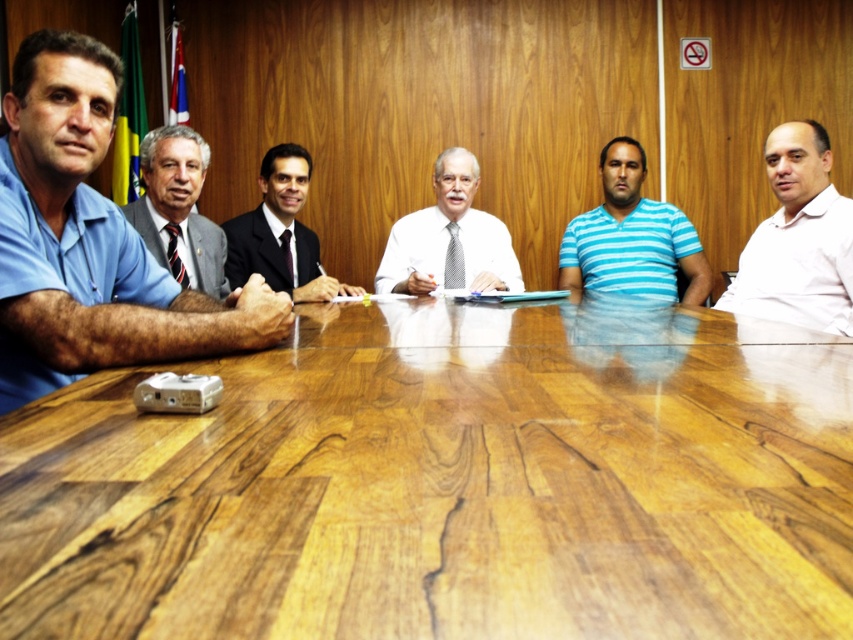
Is wooden table at center further to camera compared to white shirt at center?

No.

Based on the photo, between wooden table at center and white shirt at center, which one has less height?

With less height is wooden table at center.

Image resolution: width=853 pixels, height=640 pixels. Describe the element at coordinates (447, 483) in the screenshot. I see `wooden table at center` at that location.

Identify the location of wooden table at center. This screenshot has height=640, width=853. (447, 483).

In order to click on wooden table at center in this screenshot , I will do tap(447, 483).

Looking at this image, is wooden table at center shorter than blue fabric shirt at left?

Yes, wooden table at center is shorter than blue fabric shirt at left.

At what (x,y) coordinates should I click in order to perform the action: click on wooden table at center. Please return your answer as a coordinate pair (x, y). Looking at the image, I should click on (447, 483).

Can you confirm if blue fabric shirt at left is smaller than blue striped shirt at center?

Incorrect, blue fabric shirt at left is not smaller in size than blue striped shirt at center.

Is blue fabric shirt at left bigger than blue striped shirt at center?

Yes, blue fabric shirt at left is bigger than blue striped shirt at center.

Between point (276, 298) and point (610, 273), which one is positioned in front?

Point (276, 298)

Identify the location of blue fabric shirt at left. The width and height of the screenshot is (853, 640). [x=90, y=241].